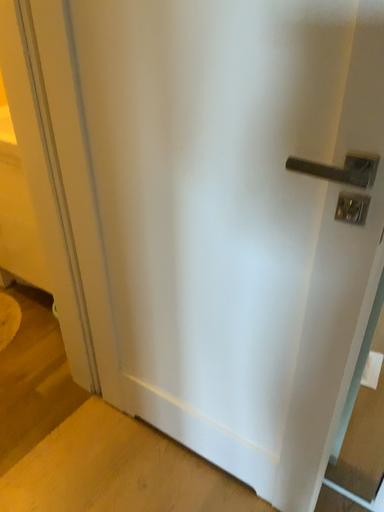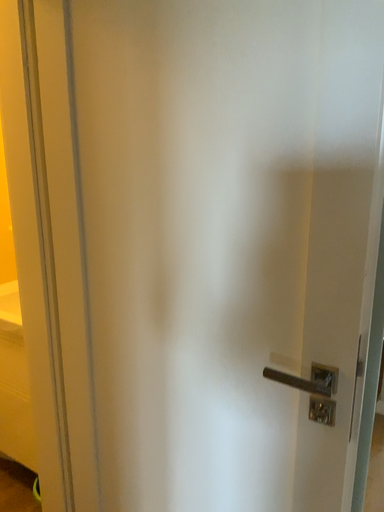
Question: Which way did the camera rotate in the video?

Choices:
 (A) rotated upward
 (B) rotated downward

Answer: (A)